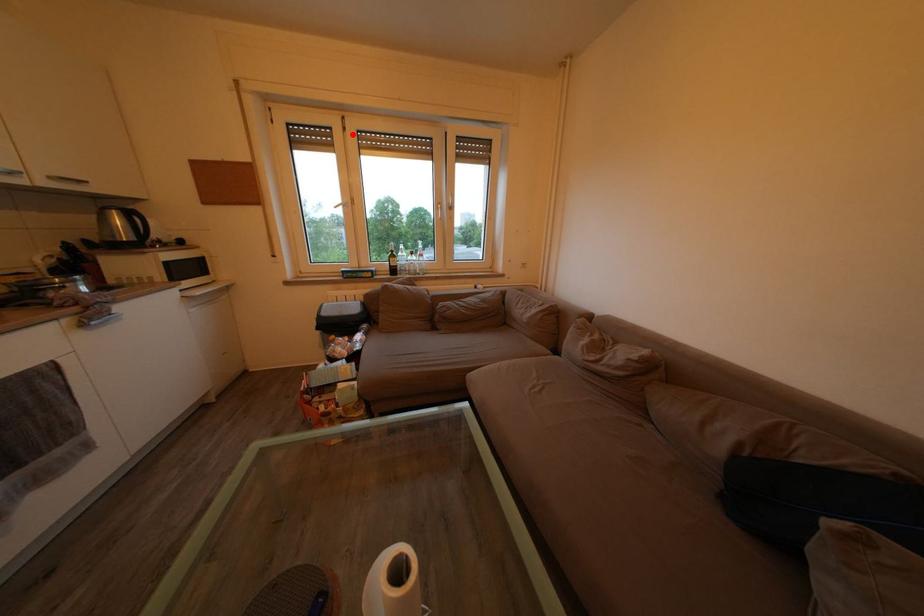
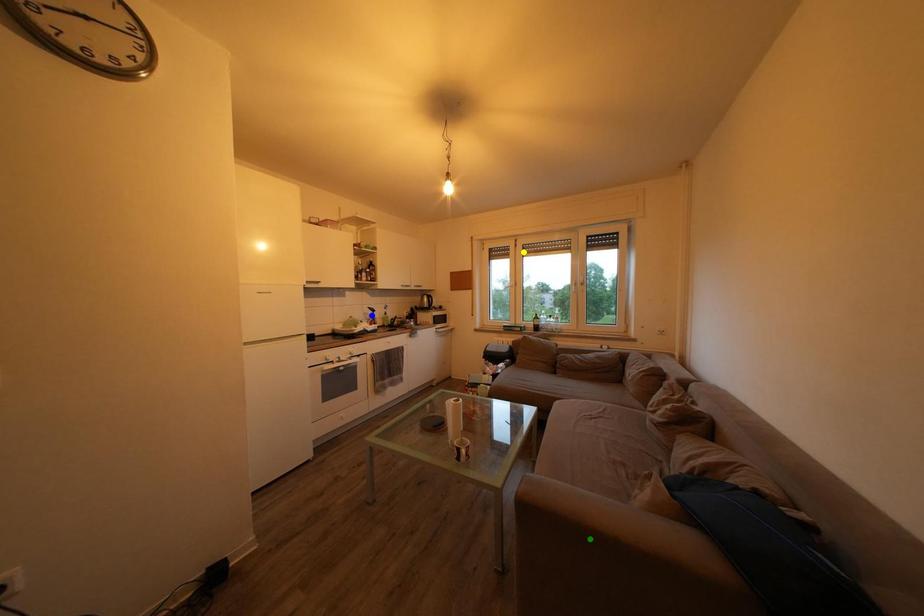
Question: I am providing you with two images of the same scene from different viewpoints. A red point is marked on the first image. You are given multiple points on the second image. Can you choose the point in image 2 that corresponds to the point in image 1?

Choices:
 (A) yellow point
 (B) green point
 (C) blue point

Answer: (A)